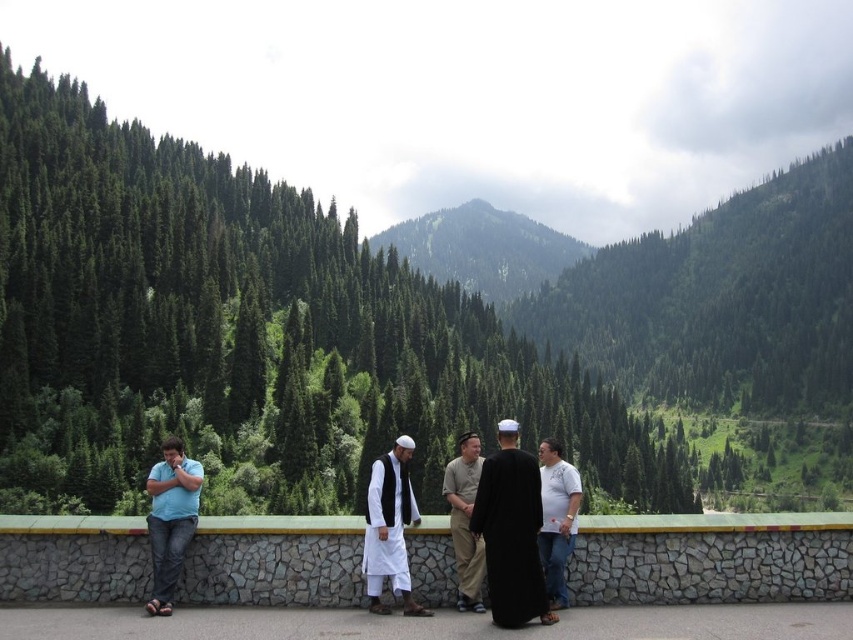
Looking at this image, does black matte robe at center come in front of white cotton shirt at center?

Yes, black matte robe at center is in front of white cotton shirt at center.

Is black matte robe at center to the left of white cotton shirt at center from the viewer's perspective?

Yes, black matte robe at center is to the left of white cotton shirt at center.

Is point (531, 512) farther from camera compared to point (573, 467)?

No, it is not.

You are a GUI agent. You are given a task and a screenshot of the screen. Output one action in this format:
    pyautogui.click(x=<x>, y=<y>)
    Task: Click on the black matte robe at center
    This screenshot has width=853, height=640.
    Given the screenshot: What is the action you would take?
    pos(511,531)

In the scene shown: Does green leafy trees at center have a greater height compared to light brown cotton shirt at center?

Correct, green leafy trees at center is much taller as light brown cotton shirt at center.

You are a GUI agent. You are given a task and a screenshot of the screen. Output one action in this format:
    pyautogui.click(x=<x>, y=<y>)
    Task: Click on the green leafy trees at center
    The image size is (853, 640).
    Given the screenshot: What is the action you would take?
    pyautogui.click(x=250, y=337)

I want to click on green leafy trees at center, so click(250, 337).

From the picture: Measure the distance between blue jeans at left and light brown cotton shirt at center.

blue jeans at left is 14.85 meters away from light brown cotton shirt at center.

Can you confirm if blue jeans at left is positioned to the left of light brown cotton shirt at center?

Correct, you'll find blue jeans at left to the left of light brown cotton shirt at center.

Describe the element at coordinates (170, 518) in the screenshot. This screenshot has height=640, width=853. I see `blue jeans at left` at that location.

Locate an element on the screen. blue jeans at left is located at coordinates (170, 518).